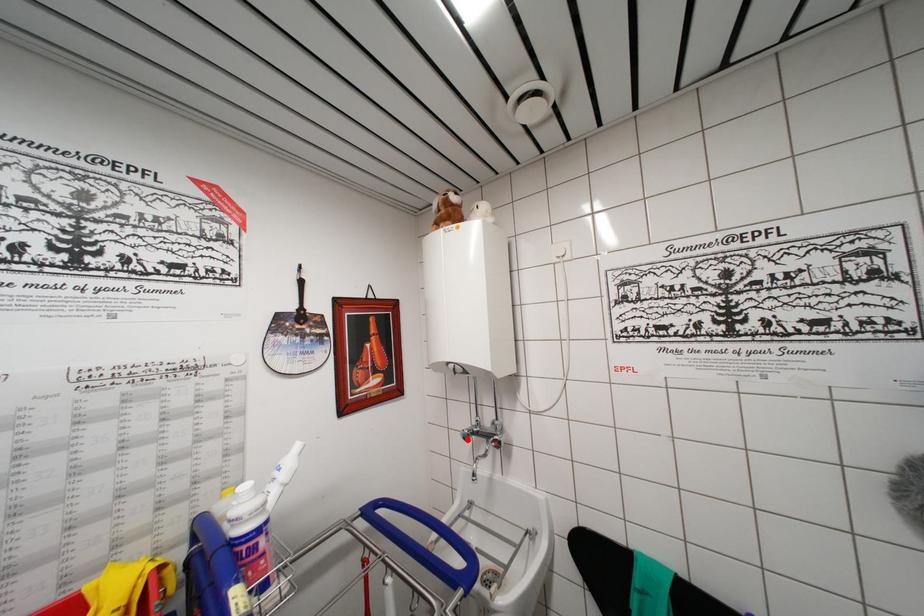
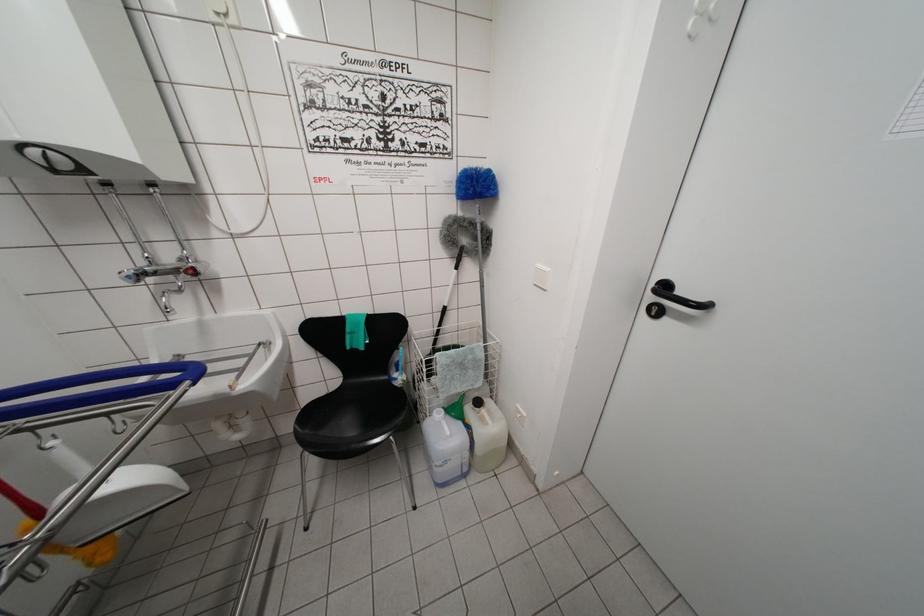
The point at the highlighted location is marked in the first image. Where is the corresponding point in the second image?

(131, 282)